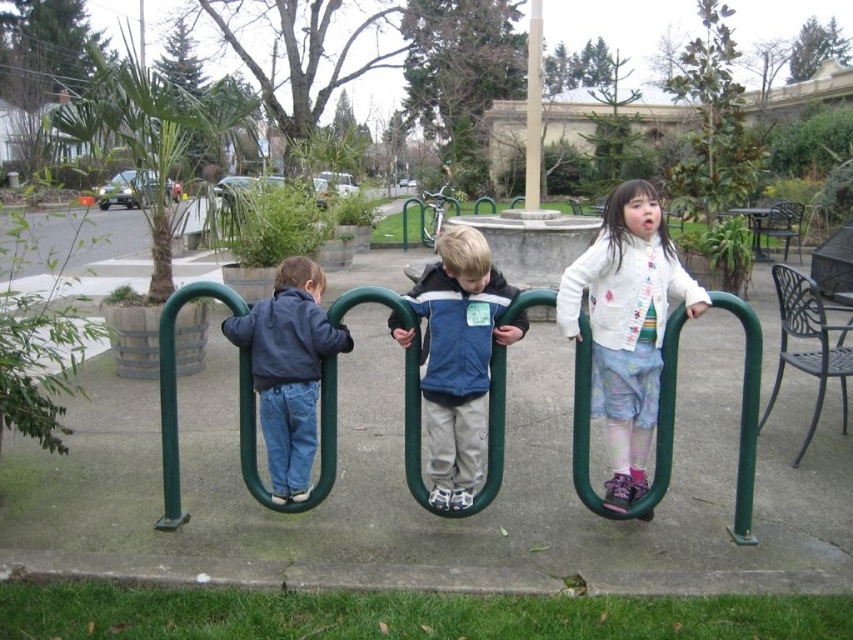
Is point (590, 500) farther from camera compared to point (438, 376)?

Yes, point (590, 500) is farther from viewer.

The height and width of the screenshot is (640, 853). I want to click on green plastic playground equipment at center, so click(657, 420).

Who is positioned more to the right, blue fleece jacket at center or smooth beige pole at center?

smooth beige pole at center is more to the right.

Does blue fleece jacket at center have a larger size compared to smooth beige pole at center?

Actually, blue fleece jacket at center might be smaller than smooth beige pole at center.

Where is `blue fleece jacket at center`? Image resolution: width=853 pixels, height=640 pixels. blue fleece jacket at center is located at coordinates (459, 356).

Image resolution: width=853 pixels, height=640 pixels. What are the coordinates of `blue fleece jacket at center` in the screenshot? It's located at (459, 356).

How much distance is there between green plastic playground equipment at center and matte blue jacket at left?

A distance of 16.48 inches exists between green plastic playground equipment at center and matte blue jacket at left.

Is green plastic playground equipment at center further to the viewer compared to matte blue jacket at left?

No, it is in front of matte blue jacket at left.

In order to click on green plastic playground equipment at center in this screenshot , I will do `click(657, 420)`.